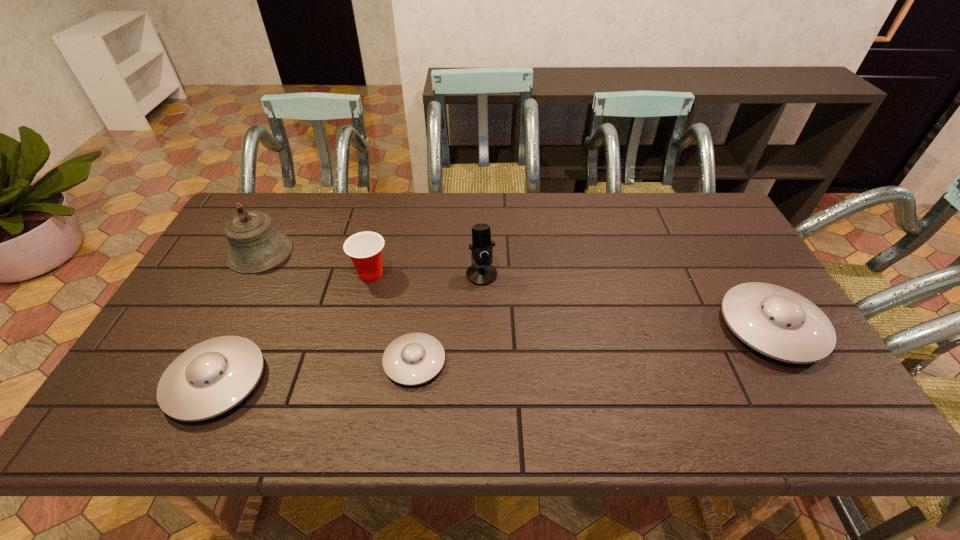
Find the location of `object that is at the near left corner`. object that is at the near left corner is located at coordinates (210, 378).

The width and height of the screenshot is (960, 540). Identify the location of object positioned at the near right corner. (777, 322).

In the image, there is a desktop. Identify the location of free space at the far edge. (349, 226).

In order to click on vacant area at the near edge in this screenshot , I will do pyautogui.click(x=264, y=373).

The height and width of the screenshot is (540, 960). I want to click on vacant space at the left edge of the desktop, so click(170, 335).

In the image, there is a desktop. Identify the location of vacant area at the far left corner. Image resolution: width=960 pixels, height=540 pixels. (279, 215).

Locate an element on the screen. The width and height of the screenshot is (960, 540). unoccupied position between the rightmost object and the bell is located at coordinates (516, 289).

The height and width of the screenshot is (540, 960). I want to click on vacant point located between the rightmost object and the microphone, so click(627, 301).

This screenshot has width=960, height=540. In order to click on free space between the cup and the bell in this screenshot , I will do `click(316, 263)`.

Where is `empty space that is in between the bell and the third object from left to right`? This screenshot has width=960, height=540. empty space that is in between the bell and the third object from left to right is located at coordinates (316, 263).